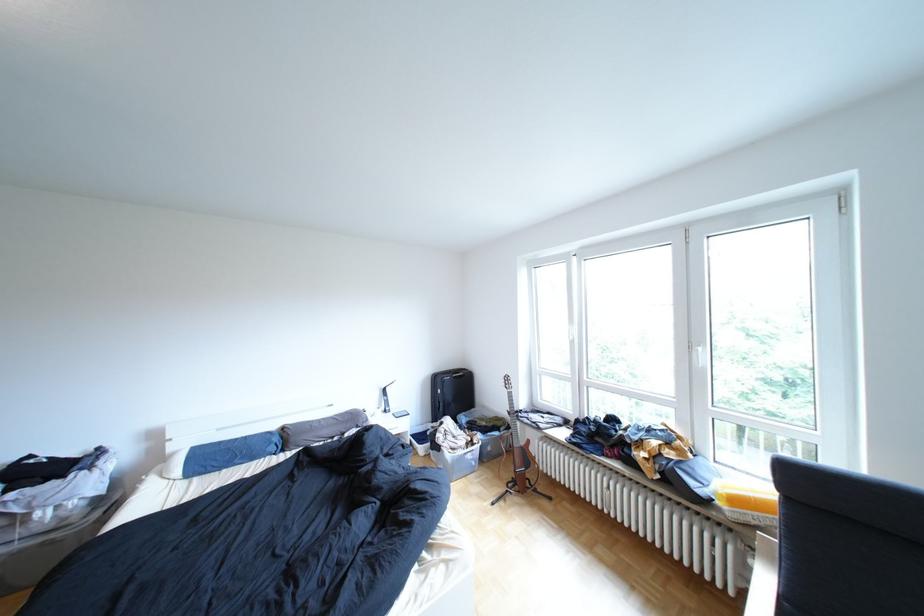
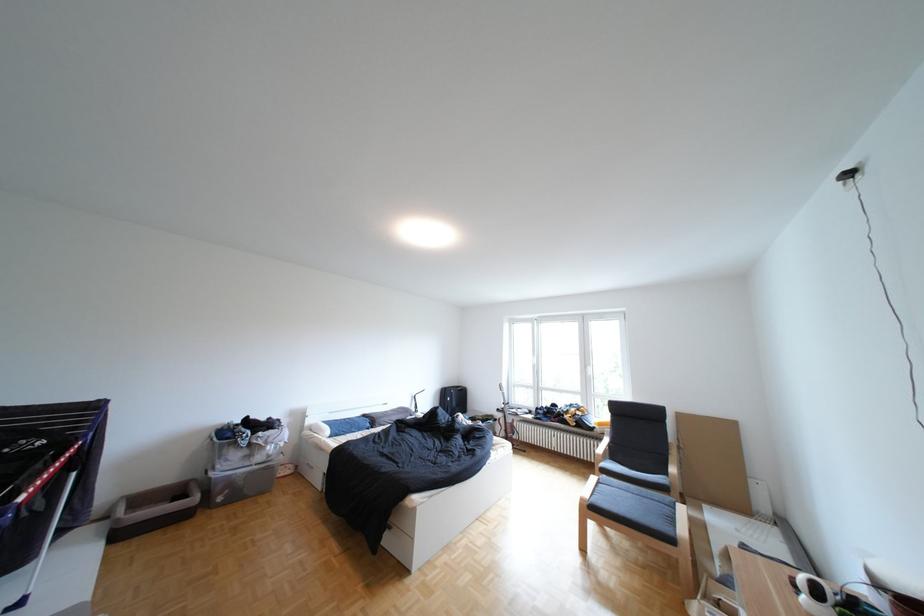
Find the pixel in the second image that matches the point at 452,379 in the first image.

(459, 392)